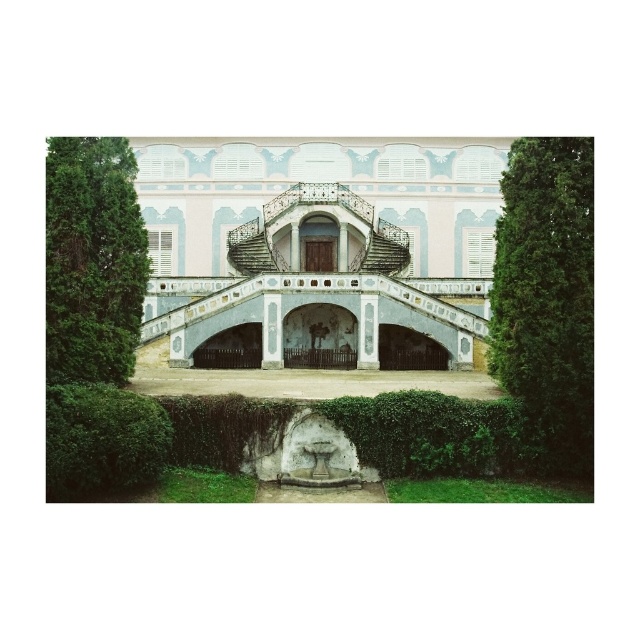
Question: Which object appears farthest from the camera in this image?

Choices:
 (A) green ivy hedge at lower center
 (B) brown wooden door at center

Answer: (B)

Question: Which object is farther from the camera taking this photo?

Choices:
 (A) green leafy hedge at right
 (B) brown wooden door at center
 (C) green leafy hedge at lower left

Answer: (B)

Question: Is green leafy hedge at right to the right of green leafy hedge at left from the viewer's perspective?

Choices:
 (A) yes
 (B) no

Answer: (A)

Question: Is pastel painted palace at center above green leafy hedge at lower left?

Choices:
 (A) no
 (B) yes

Answer: (B)

Question: Which of the following is the closest to the observer?

Choices:
 (A) green leafy hedge at right
 (B) green leafy hedge at lower left

Answer: (B)

Question: Can you confirm if black matte door at center is positioned below brown wooden door at center?

Choices:
 (A) no
 (B) yes

Answer: (B)